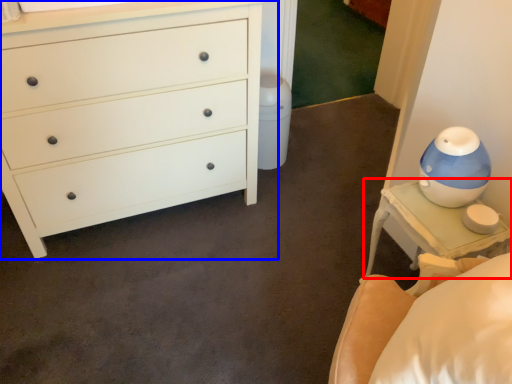
Question: Among these objects, which one is farthest to the camera, nightstand (highlighted by a red box) or chest of drawers (highlighted by a blue box)?

Choices:
 (A) nightstand
 (B) chest of drawers

Answer: (A)